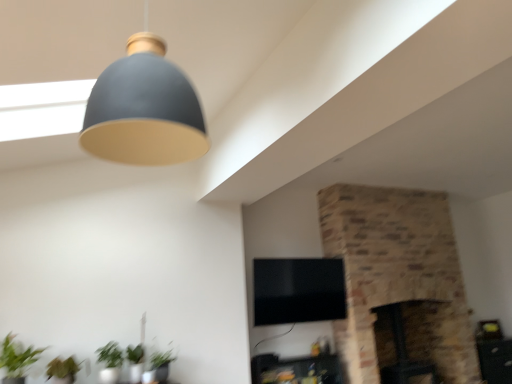
The height and width of the screenshot is (384, 512). I want to click on wooden side table at lower right, the second furniture in the front-to-back sequence, so click(x=495, y=360).

Identify the location of brick fireplace at center, which is the second fireplace from left to right. (398, 280).

Where is `dark brown stone fireplace at center-right, the 1th fireplace when ordered from left to right`? This screenshot has width=512, height=384. dark brown stone fireplace at center-right, the 1th fireplace when ordered from left to right is located at coordinates [x=402, y=352].

The image size is (512, 384). Describe the element at coordinates (110, 355) in the screenshot. I see `green matte plant at lower left, which ranks as the first plant in right-to-left order` at that location.

Locate an element on the screen. The width and height of the screenshot is (512, 384). green leafy plant at lower left, acting as the first plant starting from the left is located at coordinates (63, 370).

Image resolution: width=512 pixels, height=384 pixels. What do you see at coordinates (63, 370) in the screenshot? I see `green leafy plant at lower left, which is the 2th plant from right to left` at bounding box center [63, 370].

Locate an element on the screen. wooden side table at lower right, placed as the 2th furniture when sorted from left to right is located at coordinates [495, 360].

In the scene shown: Is matte black tv stand at lower center, which is the 2th furniture from back to front, aimed at brick fireplace at center, which is the second fireplace from left to right?

No, matte black tv stand at lower center, which is the 2th furniture from back to front, is not aimed at brick fireplace at center, which is the second fireplace from left to right.

This screenshot has width=512, height=384. Find the location of `furniture to the left of brick fireplace at center, acting as the 1th fireplace starting from the right`. furniture to the left of brick fireplace at center, acting as the 1th fireplace starting from the right is located at coordinates (296, 368).

Is the position of matte black tv stand at lower center, which is the second furniture in right-to-left order, more distant than that of brick fireplace at center, acting as the 1th fireplace starting from the right?

No, it is in front of brick fireplace at center, acting as the 1th fireplace starting from the right.

Is matte black tv stand at lower center, which is the 2th furniture from back to front, to the left of brick fireplace at center, which is the second fireplace from left to right, from the viewer's perspective?

Yes, matte black tv stand at lower center, which is the 2th furniture from back to front, is to the left of brick fireplace at center, which is the second fireplace from left to right.

From a real-world perspective, is brick fireplace at center, acting as the 1th fireplace starting from the right, physically below matte gray lampshade at upper center?

Indeed, from a real-world perspective, brick fireplace at center, acting as the 1th fireplace starting from the right, is positioned beneath matte gray lampshade at upper center.

Is brick fireplace at center, acting as the 1th fireplace starting from the right, beside matte gray lampshade at upper center?

They are not placed beside each other.

From the picture: Can you confirm if brick fireplace at center, acting as the 1th fireplace starting from the right, is thinner than matte gray lampshade at upper center?

No.

From the image's perspective, is dark brown stone fireplace at center-right, acting as the 2th fireplace starting from the right, located beneath green matte plant at lower left?

Yes.

Between dark brown stone fireplace at center-right, the 1th fireplace when ordered from left to right, and green matte plant at lower left, which one is positioned in front?

Positioned in front is green matte plant at lower left.

Is dark brown stone fireplace at center-right, the 1th fireplace when ordered from left to right, placed right next to green matte plant at lower left?

They are not placed beside each other.

How many degrees apart are the facing directions of green matte plant at lower left and green leafy plant at lower left, which is the 2th plant from right to left?

green matte plant at lower left and green leafy plant at lower left, which is the 2th plant from right to left, are facing 2.32 degrees away from each other.

From a real-world perspective, is green matte plant at lower left located beneath green leafy plant at lower left, acting as the first plant starting from the left?

Incorrect, from a real-world perspective, green matte plant at lower left is higher than green leafy plant at lower left, acting as the first plant starting from the left.

Based on the photo, is green matte plant at lower left wider or thinner than green leafy plant at lower left, acting as the first plant starting from the left?

In the image, green matte plant at lower left appears to be more narrow than green leafy plant at lower left, acting as the first plant starting from the left.

Which object is closer to the camera taking this photo, green matte plant at lower left or green leafy plant at lower left, acting as the first plant starting from the left?

green matte plant at lower left is in front.

Are matte black tv stand at lower center, the first furniture viewed from the front, and wooden side table at lower right, the 1th furniture when ordered from back to front, far apart?

Yes, matte black tv stand at lower center, the first furniture viewed from the front, and wooden side table at lower right, the 1th furniture when ordered from back to front, are located far from each other.

Is matte black tv stand at lower center, which is the second furniture in right-to-left order, at the left side of wooden side table at lower right, placed as the 2th furniture when sorted from left to right?

Correct, you'll find matte black tv stand at lower center, which is the second furniture in right-to-left order, to the left of wooden side table at lower right, placed as the 2th furniture when sorted from left to right.

This screenshot has width=512, height=384. I want to click on furniture behind the matte black tv stand at lower center, which appears as the first furniture when viewed from the left, so click(x=495, y=360).

Is matte black tv stand at lower center, which is the second furniture in right-to-left order, further to the viewer compared to wooden side table at lower right, the second furniture in the front-to-back sequence?

No, it is in front of wooden side table at lower right, the second furniture in the front-to-back sequence.

Between green matte plant at lower left and brick fireplace at center, which is the second fireplace from left to right, which one has more height?

brick fireplace at center, which is the second fireplace from left to right, is taller.

Is green matte plant at lower left not near brick fireplace at center, which is the second fireplace from left to right?

Absolutely, green matte plant at lower left is distant from brick fireplace at center, which is the second fireplace from left to right.

Is the position of green matte plant at lower left less distant than that of brick fireplace at center, acting as the 1th fireplace starting from the right?

Yes, the depth of green matte plant at lower left is less than that of brick fireplace at center, acting as the 1th fireplace starting from the right.

Which is less distant, [19,360] or [441,365]?

Point [19,360] is positioned closer to the camera compared to point [441,365].

Is matte gray lampshade at upper center at the back of green matte plant at lower left, arranged as the 2th plant when viewed from the left?

That's not correct — green matte plant at lower left, arranged as the 2th plant when viewed from the left, is not looking away from matte gray lampshade at upper center.

Is green matte plant at lower left, arranged as the 2th plant when viewed from the left, next to matte gray lampshade at upper center?

No, green matte plant at lower left, arranged as the 2th plant when viewed from the left, is not touching matte gray lampshade at upper center.

Between green matte plant at lower left, arranged as the 2th plant when viewed from the left, and matte gray lampshade at upper center, which one has larger size?

With larger size is matte gray lampshade at upper center.

Where is `lamp lying above the green matte plant at lower left, which ranks as the first plant in right-to-left order (from the image's perspective)`? Image resolution: width=512 pixels, height=384 pixels. lamp lying above the green matte plant at lower left, which ranks as the first plant in right-to-left order (from the image's perspective) is located at coordinates (144, 109).

The height and width of the screenshot is (384, 512). Find the location of `the 2nd fireplace counting from the right of the matte black tv stand at lower center, which is the second furniture in right-to-left order`. the 2nd fireplace counting from the right of the matte black tv stand at lower center, which is the second furniture in right-to-left order is located at coordinates (398, 280).

This screenshot has width=512, height=384. Identify the location of the 1st fireplace behind when counting from the matte gray lampshade at upper center. point(398,280).

Looking at the image, which one is located further to wooden side table at lower right, the first furniture viewed from the right, green matte plant at lower left, which ranks as the first plant in right-to-left order, or brick fireplace at center, which is the second fireplace from left to right?

Among the two, green matte plant at lower left, which ranks as the first plant in right-to-left order, is located further to wooden side table at lower right, the first furniture viewed from the right.

When comparing their distances from dark brown stone fireplace at center-right, the 1th fireplace when ordered from left to right, does wooden side table at lower right, placed as the 2th furniture when sorted from left to right, or matte gray lampshade at upper center seem closer?

Among the two, wooden side table at lower right, placed as the 2th furniture when sorted from left to right, is located nearer to dark brown stone fireplace at center-right, the 1th fireplace when ordered from left to right.

Looking at the image, which one is located closer to matte gray lampshade at upper center, dark brown stone fireplace at center-right, acting as the 2th fireplace starting from the right, or green matte plant at lower left?

green matte plant at lower left lies closer to matte gray lampshade at upper center than the other object.

Considering their positions, is green leafy plant at lower left, which is the 2th plant from right to left, positioned further to wooden side table at lower right, placed as the 2th furniture when sorted from left to right, than dark brown stone fireplace at center-right, the 1th fireplace when ordered from left to right?

green leafy plant at lower left, which is the 2th plant from right to left.

Considering their positions, is matte black tv stand at lower center, which is the 2th furniture from back to front, positioned closer to wooden side table at lower right, the 1th furniture when ordered from back to front, than green matte plant at lower left?

matte black tv stand at lower center, which is the 2th furniture from back to front, lies closer to wooden side table at lower right, the 1th furniture when ordered from back to front, than the other object.

Based on their spatial positions, is green matte plant at lower left or matte black tv stand at lower center, which appears as the first furniture when viewed from the left, closer to dark brown stone fireplace at center-right, the 1th fireplace when ordered from left to right?

The object closer to dark brown stone fireplace at center-right, the 1th fireplace when ordered from left to right, is matte black tv stand at lower center, which appears as the first furniture when viewed from the left.

Estimate the real-world distances between objects in this image. Which object is closer to brick fireplace at center, which is the second fireplace from left to right, matte black tv stand at lower center, which is the 2th furniture from back to front, or green matte plant at lower left, arranged as the 2th plant when viewed from the left?

matte black tv stand at lower center, which is the 2th furniture from back to front, lies closer to brick fireplace at center, which is the second fireplace from left to right, than the other object.

Considering their positions, is green leafy plant at lower left, acting as the first plant starting from the left, positioned further to matte gray lampshade at upper center than green matte plant at lower left, which ranks as the first plant in right-to-left order?

green matte plant at lower left, which ranks as the first plant in right-to-left order.

Where is `plant between green leafy plant at lower left, which is the 2th plant from right to left, and brick fireplace at center, acting as the 1th fireplace starting from the right, in the horizontal direction`? The height and width of the screenshot is (384, 512). plant between green leafy plant at lower left, which is the 2th plant from right to left, and brick fireplace at center, acting as the 1th fireplace starting from the right, in the horizontal direction is located at coordinates (110, 355).

Image resolution: width=512 pixels, height=384 pixels. What are the coordinates of `houseplant between matte gray lampshade at upper center and green leafy plant at lower left, which is the 2th plant from right to left, in the vertical direction` in the screenshot? It's located at (16, 359).

Find the location of a particular element. plant between matte gray lampshade at upper center and green leafy plant at lower left, acting as the first plant starting from the left, in the up-down direction is located at coordinates (110, 355).

You are a GUI agent. You are given a task and a screenshot of the screen. Output one action in this format:
    pyautogui.click(x=<x>, y=<y>)
    Task: Click on the furniture between green matte plant at lower left and dark brown stone fireplace at center-right, acting as the 2th fireplace starting from the right, from left to right
    The width and height of the screenshot is (512, 384).
    Given the screenshot: What is the action you would take?
    pyautogui.click(x=296, y=368)